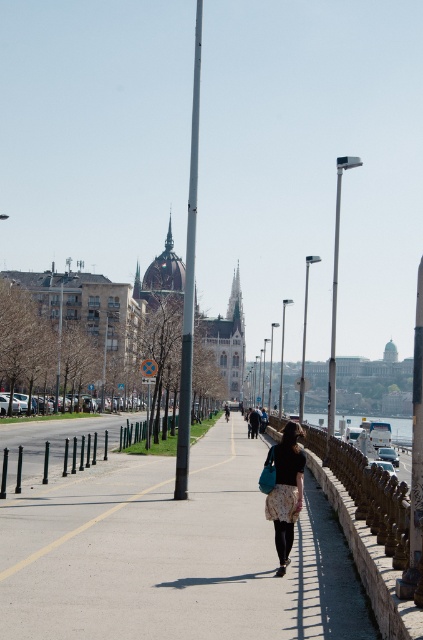
You are a delivery person trying to place a large package on the ground. You see the concrete sidewalk at center and the floral skirt at center in the scene. Which surface can you safely place the package on?

The concrete sidewalk at center has a larger size compared to the floral skirt at center, so the package can be safely placed on the concrete sidewalk at center.